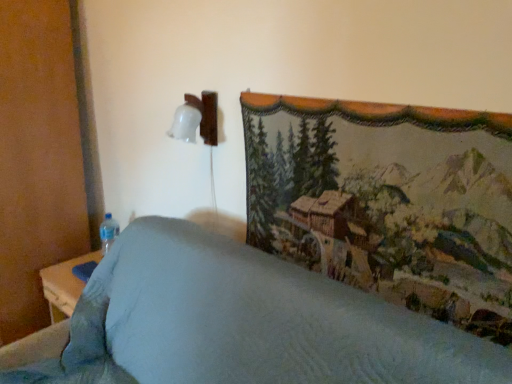
Measure the distance between textured fabric bedspread at center and camera.

textured fabric bedspread at center is 32.19 inches away from camera.

The height and width of the screenshot is (384, 512). Find the location of `textured tapestry at upper right`. textured tapestry at upper right is located at coordinates (388, 201).

Does textured tapestry at upper right come in front of textured fabric bedspread at center?

No, the depth of textured tapestry at upper right is greater than that of textured fabric bedspread at center.

Is textured tapestry at upper right to the left of textured fabric bedspread at center from the viewer's perspective?

No.

Identify the location of mountain landscape on the right of textured fabric bedspread at center. This screenshot has height=384, width=512. (388, 201).

Who is smaller, textured tapestry at upper right or textured fabric bedspread at center?

Smaller between the two is textured tapestry at upper right.

Considering the positions of point (110, 237) and point (304, 185), is point (110, 237) closer or farther from the camera than point (304, 185)?

Point (110, 237).

Which of these two, transparent plastic bottle at lower left or textured tapestry at upper right, is wider?

Wider between the two is transparent plastic bottle at lower left.

From the image's perspective, which is below, transparent plastic bottle at lower left or textured fabric bedspread at center?

textured fabric bedspread at center, from the image's perspective.

Is transparent plastic bottle at lower left directly adjacent to textured fabric bedspread at center?

No, transparent plastic bottle at lower left is not making contact with textured fabric bedspread at center.

In the scene shown: Could you tell me if transparent plastic bottle at lower left is turned towards textured fabric bedspread at center?

No, transparent plastic bottle at lower left is not facing towards textured fabric bedspread at center.

Considering the sizes of textured fabric bedspread at center and textured tapestry at upper right in the image, is textured fabric bedspread at center wider or thinner than textured tapestry at upper right?

In the image, textured fabric bedspread at center appears to be wider than textured tapestry at upper right.

Is textured fabric bedspread at center bigger or smaller than textured tapestry at upper right?

In the image, textured fabric bedspread at center appears to be larger than textured tapestry at upper right.

Measure the distance between textured fabric bedspread at center and textured tapestry at upper right.

The distance of textured fabric bedspread at center from textured tapestry at upper right is 35.56 centimeters.

Is point (395, 360) positioned after point (480, 186)?

No, (395, 360) is in front of (480, 186).

Who is shorter, textured tapestry at upper right or transparent plastic bottle at lower left?

Standing shorter between the two is transparent plastic bottle at lower left.

Could you tell me if textured tapestry at upper right is turned towards transparent plastic bottle at lower left?

No.

From the picture: Would you say textured tapestry at upper right is outside transparent plastic bottle at lower left?

Yes, textured tapestry at upper right is outside of transparent plastic bottle at lower left.

Identify the location of furniture on the right of transparent plastic bottle at lower left. The width and height of the screenshot is (512, 384). (246, 323).

Measure the distance from textured fabric bedspread at center to transparent plastic bottle at lower left.

textured fabric bedspread at center and transparent plastic bottle at lower left are 32.64 inches apart from each other.

From the image's perspective, is textured fabric bedspread at center positioned above or below transparent plastic bottle at lower left?

textured fabric bedspread at center is situated lower than transparent plastic bottle at lower left in the image.

Is textured fabric bedspread at center not within transparent plastic bottle at lower left?

Yes, textured fabric bedspread at center is located beyond the bounds of transparent plastic bottle at lower left.

The image size is (512, 384). What are the coordinates of `furniture below the textured tapestry at upper right (from the image's perspective)` in the screenshot? It's located at (246, 323).

Where is `bottle that is under the textured tapestry at upper right (from a real-world perspective)`? This screenshot has height=384, width=512. bottle that is under the textured tapestry at upper right (from a real-world perspective) is located at coordinates coord(108,232).

From the image, which object appears to be nearer to textured fabric bedspread at center, textured tapestry at upper right or transparent plastic bottle at lower left?

textured tapestry at upper right.

Looking at the image, which one is located further to textured fabric bedspread at center, transparent plastic bottle at lower left or textured tapestry at upper right?

transparent plastic bottle at lower left.

Considering their positions, is textured fabric bedspread at center positioned closer to textured tapestry at upper right than transparent plastic bottle at lower left?

Based on the image, textured fabric bedspread at center appears to be nearer to textured tapestry at upper right.

Based on their spatial positions, is textured fabric bedspread at center or textured tapestry at upper right further from transparent plastic bottle at lower left?

Among the two, textured tapestry at upper right is located further to transparent plastic bottle at lower left.

From the picture: From the image, which object appears to be nearer to transparent plastic bottle at lower left, textured tapestry at upper right or textured fabric bedspread at center?

textured fabric bedspread at center is closer to transparent plastic bottle at lower left.

Which object lies further to the anchor point textured tapestry at upper right, transparent plastic bottle at lower left or textured fabric bedspread at center?

transparent plastic bottle at lower left is positioned further to the anchor textured tapestry at upper right.

The height and width of the screenshot is (384, 512). I want to click on mountain landscape between textured fabric bedspread at center and transparent plastic bottle at lower left along the z-axis, so click(388, 201).